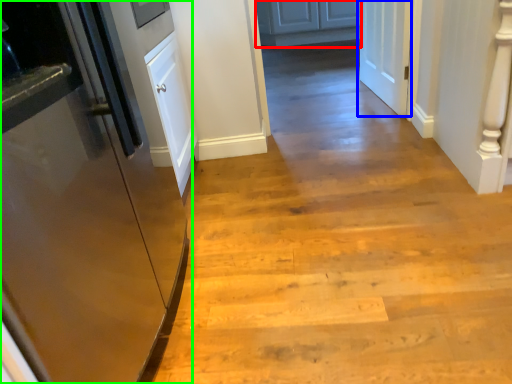
Question: Which object is positioned closest to cabinetry (highlighted by a red box)? Select from door (highlighted by a blue box) and door (highlighted by a green box).

Choices:
 (A) door
 (B) door

Answer: (A)